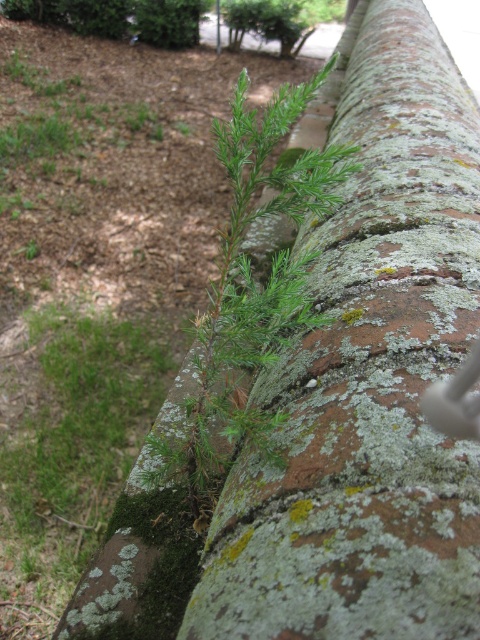
Locate an element on the screen. green mossy brick wall at upper center is located at coordinates (368, 378).

Does point (324, 220) come behind point (248, 147)?

Yes, it is.

At what (x,y) coordinates should I click in order to perform the action: click on green mossy brick wall at upper center. Please return your answer as a coordinate pair (x, y). The height and width of the screenshot is (640, 480). Looking at the image, I should click on (368, 378).